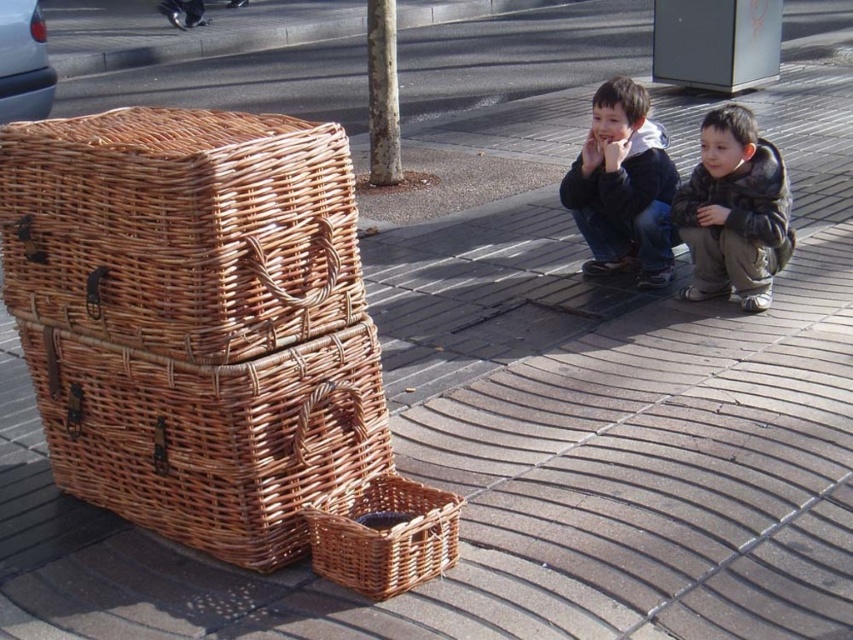
Question: Does woven brown basket at lower left lie in front of dark brown fur coat at lower right?

Choices:
 (A) no
 (B) yes

Answer: (B)

Question: Does woven brown basket at left appear under dark blue jacket at lower right?

Choices:
 (A) yes
 (B) no

Answer: (A)

Question: Estimate the real-world distances between objects in this image. Which object is farther from the woven brown basket at lower center?

Choices:
 (A) dark blue jacket at lower right
 (B) dark brown fur coat at lower right

Answer: (B)

Question: Which object is farther from the camera taking this photo?

Choices:
 (A) dark brown fur coat at lower right
 (B) woven brown basket at lower center
 (C) dark blue jacket at lower right

Answer: (C)

Question: Is woven brown basket at left to the right of woven brown basket at lower center from the viewer's perspective?

Choices:
 (A) no
 (B) yes

Answer: (A)

Question: Which point is closer to the camera?

Choices:
 (A) dark blue jacket at lower right
 (B) asphalt at upper center
 (C) woven brown basket at lower left
 (D) dark brown fur coat at lower right

Answer: (C)